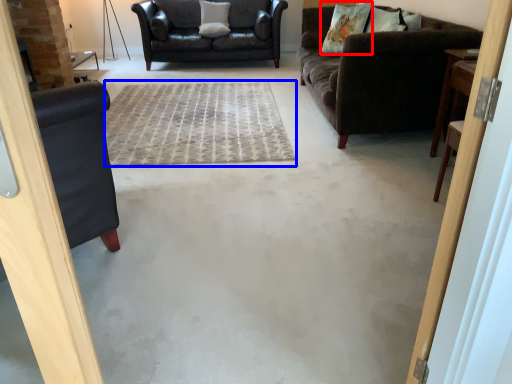
Question: Which point is closer to the camera, pillow (highlighted by a red box) or plain (highlighted by a blue box)?

Choices:
 (A) pillow
 (B) plain

Answer: (B)